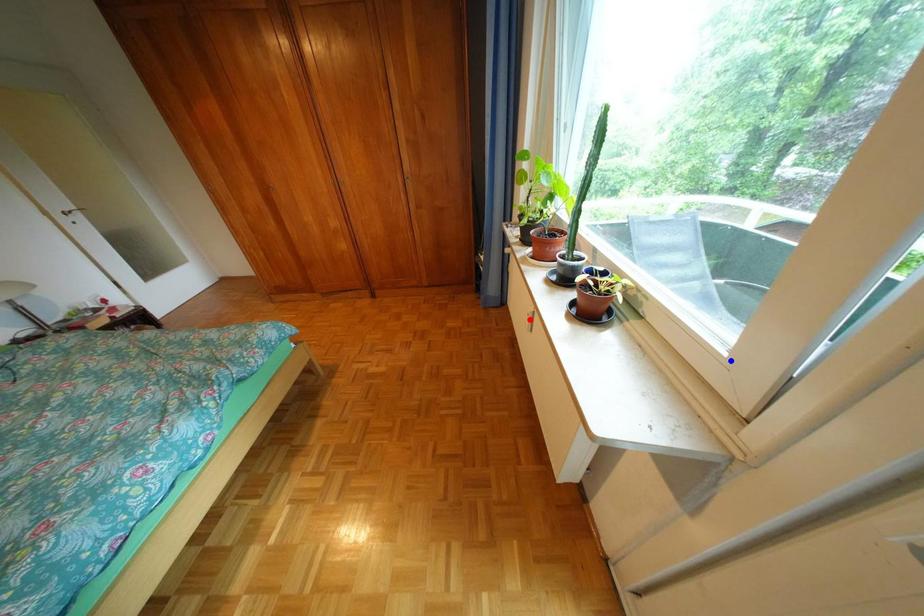
Question: In the image, two points are highlighted. Which point is nearer to the camera? Reply with the corresponding letter.

Choices:
 (A) blue point
 (B) red point

Answer: (A)